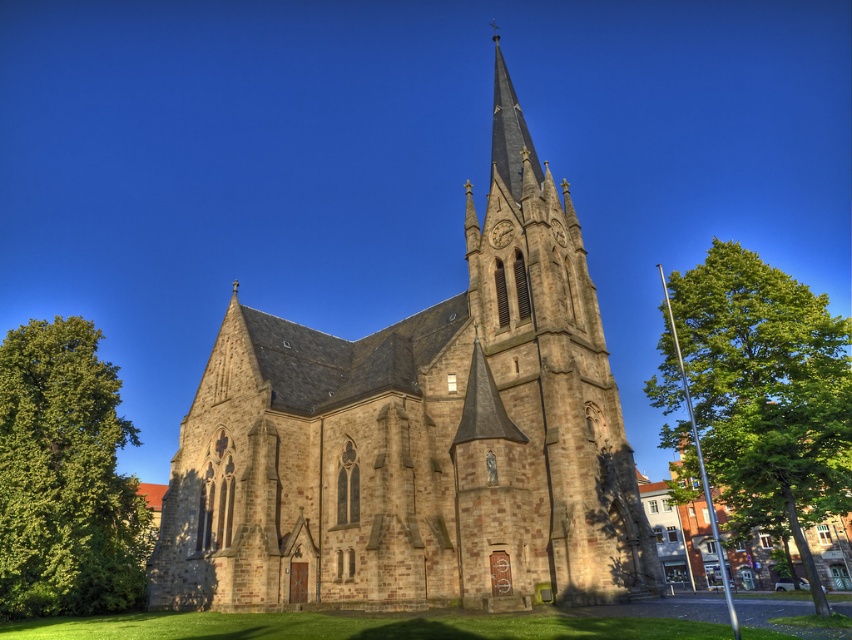
Question: Can you confirm if green leafy tree at right is thinner than green leafy tree at left?

Choices:
 (A) yes
 (B) no

Answer: (A)

Question: Which of the following is the farthest from the observer?

Choices:
 (A) green leafy tree at left
 (B) green leafy tree at right
 (C) brown stone church at center

Answer: (A)

Question: Does green leafy tree at right appear over green leafy tree at left?

Choices:
 (A) no
 (B) yes

Answer: (A)

Question: Which of the following is the closest to the observer?

Choices:
 (A) click(x=675, y=275)
 (B) click(x=24, y=504)

Answer: (B)

Question: Is brown stone church at center positioned behind green leafy tree at left?

Choices:
 (A) no
 (B) yes

Answer: (A)

Question: Which object is farther from the camera taking this photo?

Choices:
 (A) green leafy tree at right
 (B) green leafy tree at left
 (C) brown stone church at center

Answer: (B)